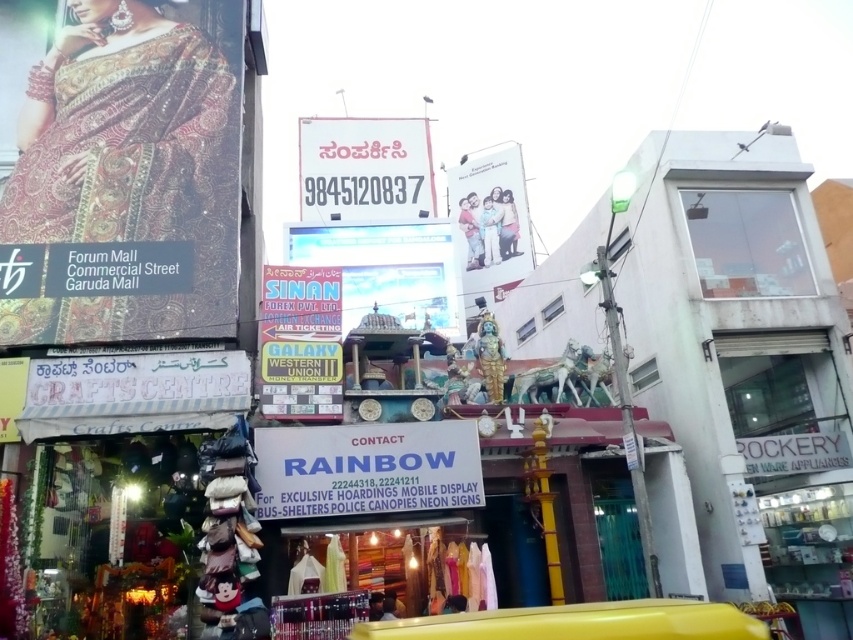
You are a customer looking to buy a shiny silk saree at upper left displayed in a shop. The shop has a white glossy billboard at center advertising their services. Can you see the billboard through the saree?

The shiny silk saree at upper left is in front of the white glossy billboard at center, so you cannot see the billboard through the saree.

You are a customer looking for a shiny silk saree at upper left in the Rainbow shop. The shop has a signboard with contact details. Can you see the contact details while standing at the point marked by coordinates point (131, 170)?

The point (131, 170) marks the shiny silk saree at upper left, which is located above the shop entrance. The shop signboard with contact details is on the entrance level, so you can see the contact details while standing at that point.

You are a customer looking to buy a saree and a billboard advertisement. The shop has a shiny silk saree at upper left and a white glossy billboard at center. Can you tell which item takes up more space in the shop?

The white glossy billboard at center occupies more space than the shiny silk saree at upper left because the shiny silk saree at upper left occupies less space than white glossy billboard at center.